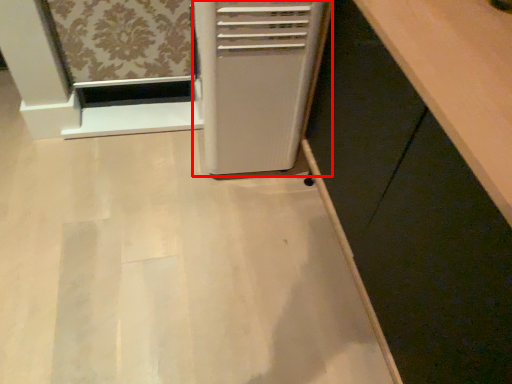
Question: From the image's perspective, considering the relative positions of home appliance (annotated by the red box) and cabinetry in the image provided, where is home appliance (annotated by the red box) located with respect to the staircase?

Choices:
 (A) below
 (B) above

Answer: (B)